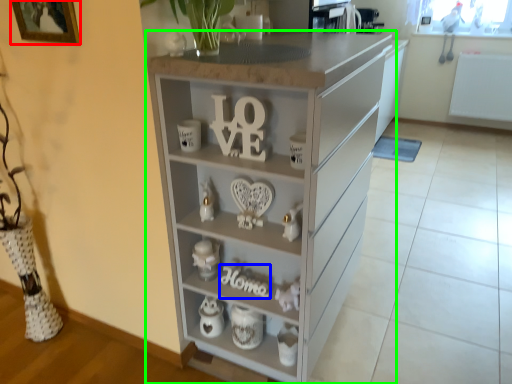
Question: Considering the real-world distances, which object is closest to picture frame (highlighted by a red box)? alphabet (highlighted by a blue box) or chest of drawers (highlighted by a green box).

Choices:
 (A) alphabet
 (B) chest of drawers

Answer: (B)